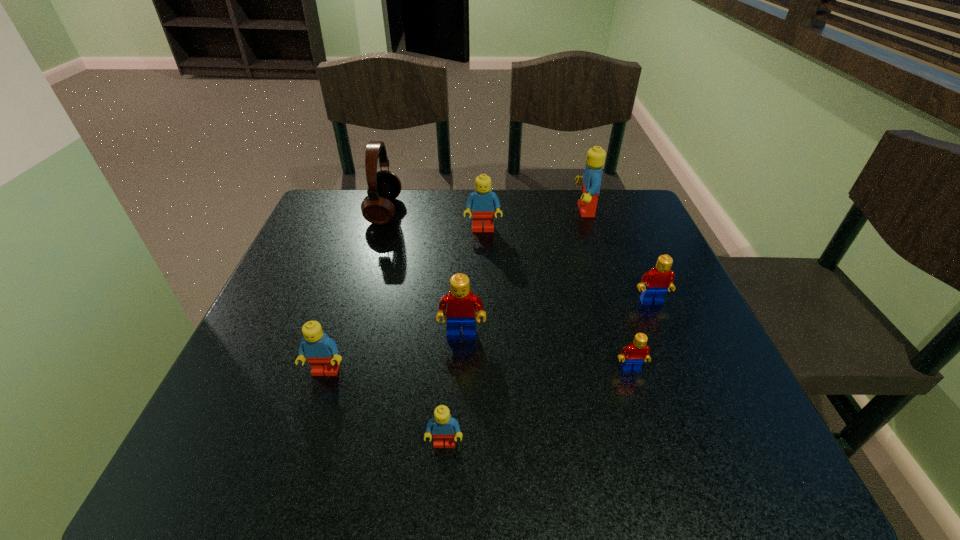
Locate which red Lego is the closest to the smallest red Lego. Please provide its 2D coordinates. Your answer should be formatted as a tuple, i.e. [(x, y)], where the tuple contains the x and y coordinates of a point satisfying the conditions above.

[(660, 278)]

This screenshot has height=540, width=960. What are the coordinates of `free region that satisfies the following two spatial constraints: 1. on the face of the biggest blue Lego; 2. on the face of the third smallest blue Lego` in the screenshot? It's located at (591, 230).